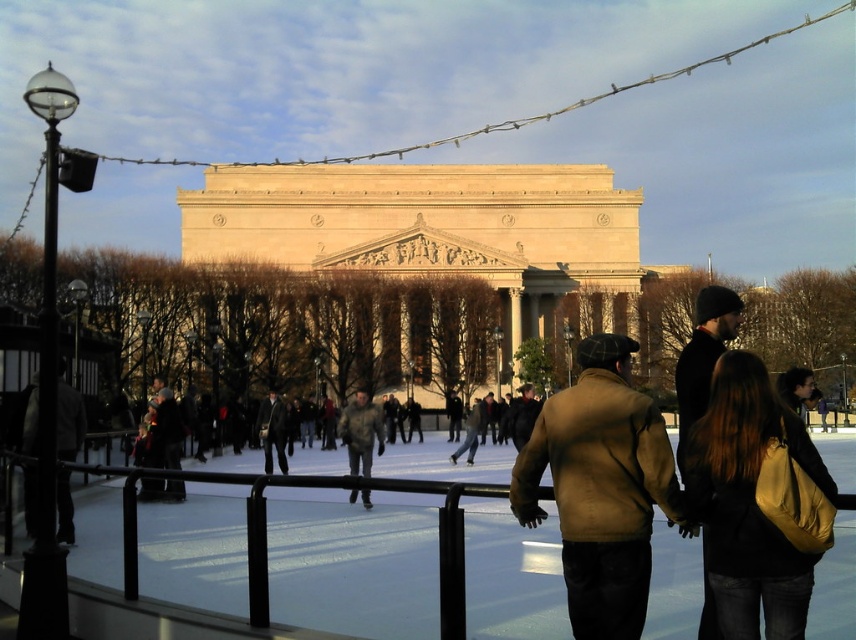
Question: Which point is closer to the camera?

Choices:
 (A) (704, 394)
 (B) (565, 573)
 (C) (159, 579)
 (D) (783, 556)

Answer: (D)

Question: Which object is positioned farthest from the black leather jacket at center?

Choices:
 (A) camouflage jacket at center
 (B) dark gray suit at center

Answer: (B)

Question: Which object is the closest to the camouflage jacket at center?

Choices:
 (A) black leather jacket at center
 (B) brown leather jacket at center

Answer: (A)

Question: Can you confirm if white ice skating rink at center is positioned below brown leather jacket at center?

Choices:
 (A) yes
 (B) no

Answer: (A)

Question: Can you confirm if white ice skating rink at center is wider than camouflage jacket at center?

Choices:
 (A) no
 (B) yes

Answer: (B)

Question: Is brown leather jacket at center smaller than dark gray suit at center?

Choices:
 (A) yes
 (B) no

Answer: (B)